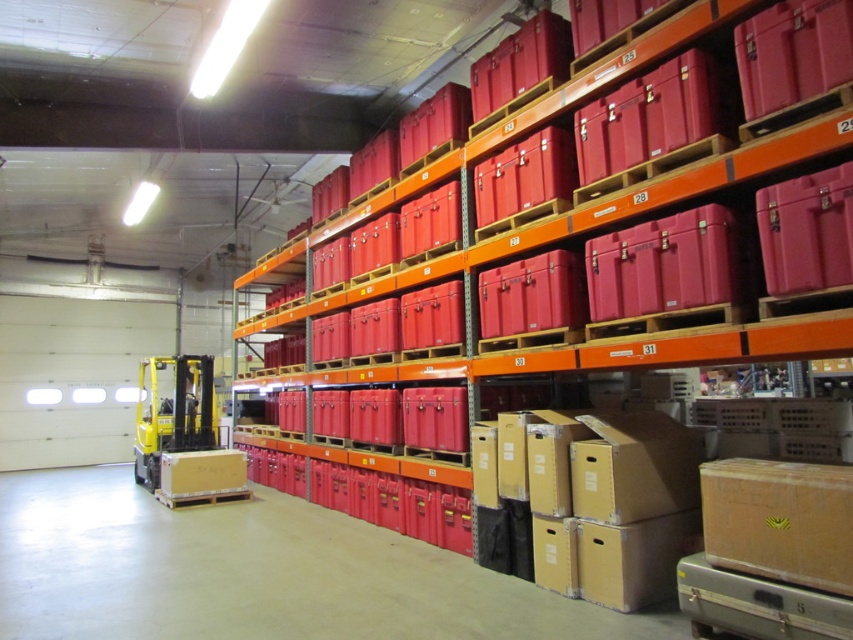
Does matte red container at upper center appear over brown cardboard box at lower right?

Correct, matte red container at upper center is located above brown cardboard box at lower right.

Looking at this image, is matte red container at upper center positioned before brown cardboard box at lower right?

No, matte red container at upper center is further to the viewer.

Image resolution: width=853 pixels, height=640 pixels. I want to click on matte red container at upper center, so click(566, 292).

This screenshot has height=640, width=853. Find the location of `matte red container at upper center`. matte red container at upper center is located at coordinates [x=566, y=292].